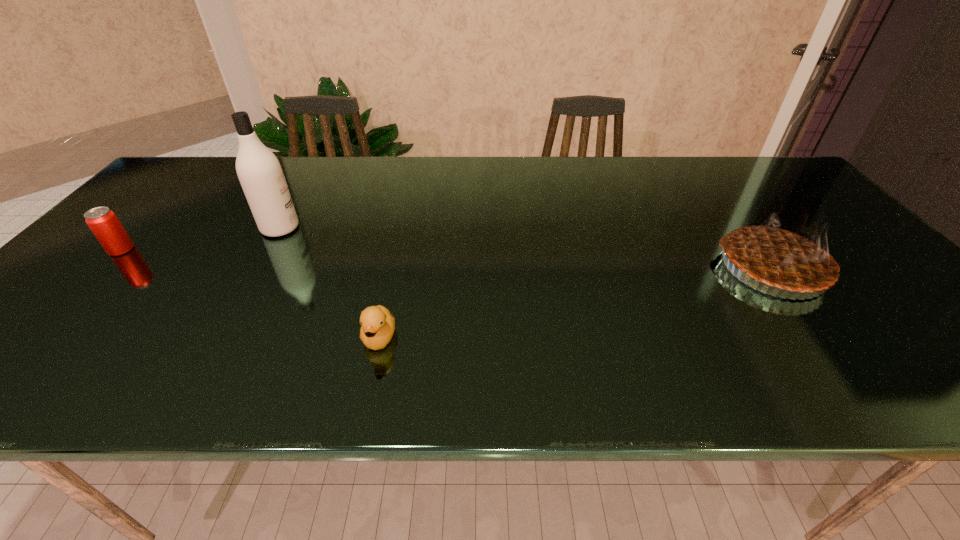
Where is `free region located on the front of the third tallest object`? free region located on the front of the third tallest object is located at coordinates (77, 296).

Where is `blank area located facing forward on the nearest object`? blank area located facing forward on the nearest object is located at coordinates (368, 392).

This screenshot has width=960, height=540. In order to click on object that is at the near edge in this screenshot , I will do `click(378, 324)`.

Locate an element on the screen. The width and height of the screenshot is (960, 540). object that is at the left edge is located at coordinates click(x=103, y=222).

Where is `object that is positioned at the right edge`? The height and width of the screenshot is (540, 960). object that is positioned at the right edge is located at coordinates (787, 256).

At what (x,y) coordinates should I click in order to perform the action: click on vacant space at the far edge. Please return your answer as a coordinate pair (x, y). This screenshot has width=960, height=540. Looking at the image, I should click on (548, 169).

The height and width of the screenshot is (540, 960). What are the coordinates of `vacant point at the near edge` in the screenshot? It's located at (55, 376).

In the image, there is a desktop. At what (x,y) coordinates should I click in order to perform the action: click on vacant space at the right edge. Please return your answer as a coordinate pair (x, y). The image size is (960, 540). Looking at the image, I should click on (x=850, y=242).

The height and width of the screenshot is (540, 960). Identify the location of blank space at the far left corner of the desktop. (217, 176).

This screenshot has height=540, width=960. Find the location of `blank space at the far right corner of the desktop`. blank space at the far right corner of the desktop is located at coordinates (746, 163).